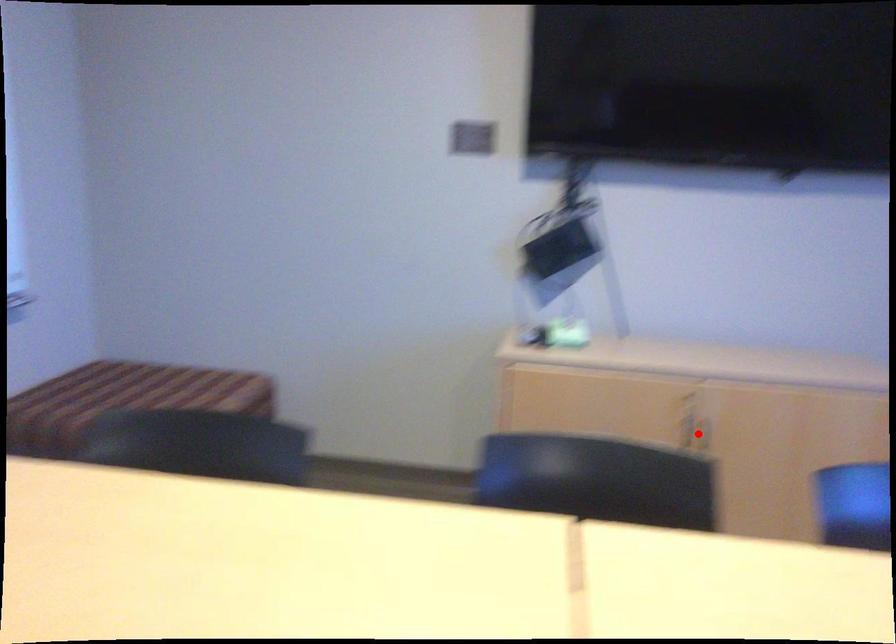
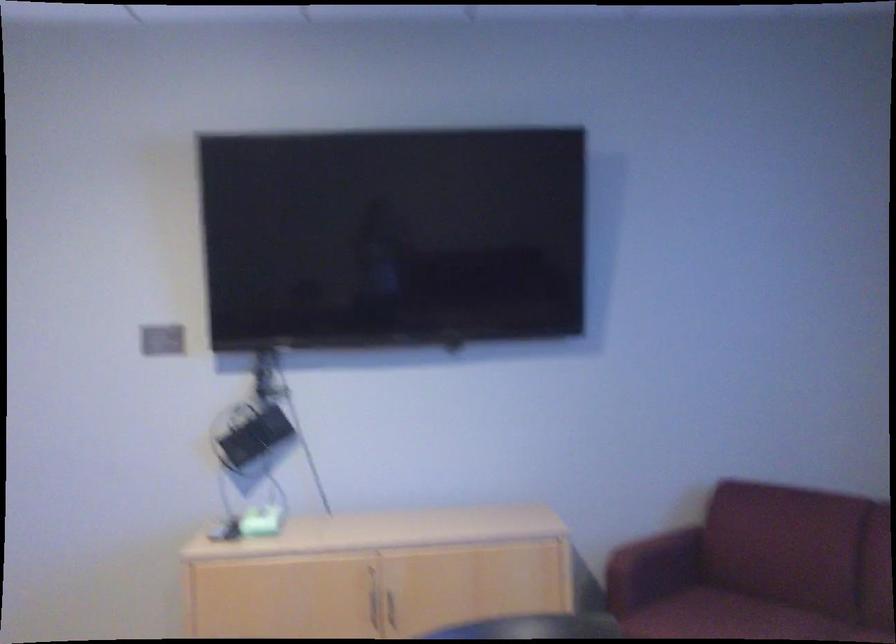
The point at the highlighted location is marked in the first image. Where is the corresponding point in the second image?

(392, 607)